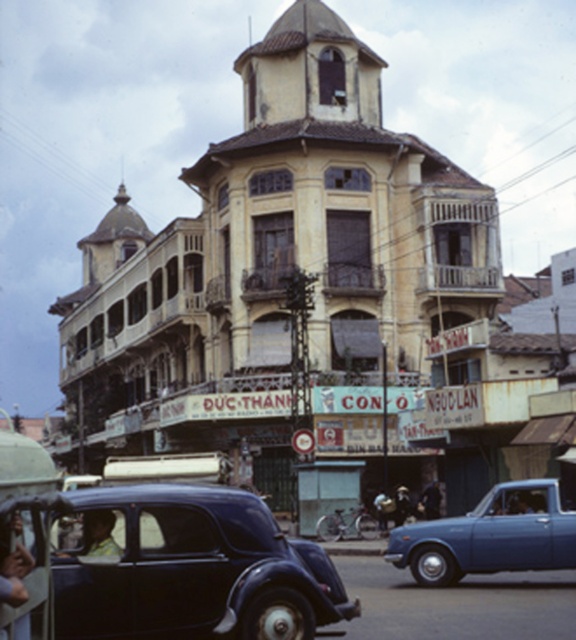
You are standing on the street in front of the building and want to take a photo of the conical roof. There are two points marked on the ground where you can stand. One is at point (x=256, y=512) and the other is at point (x=101, y=528). Which point should you choose to ensure the conical roof is fully visible without any obstruction?

Result: You should choose point (x=101, y=528) because point (x=256, y=512) is behind it, so standing there might block the view of the conical roof.